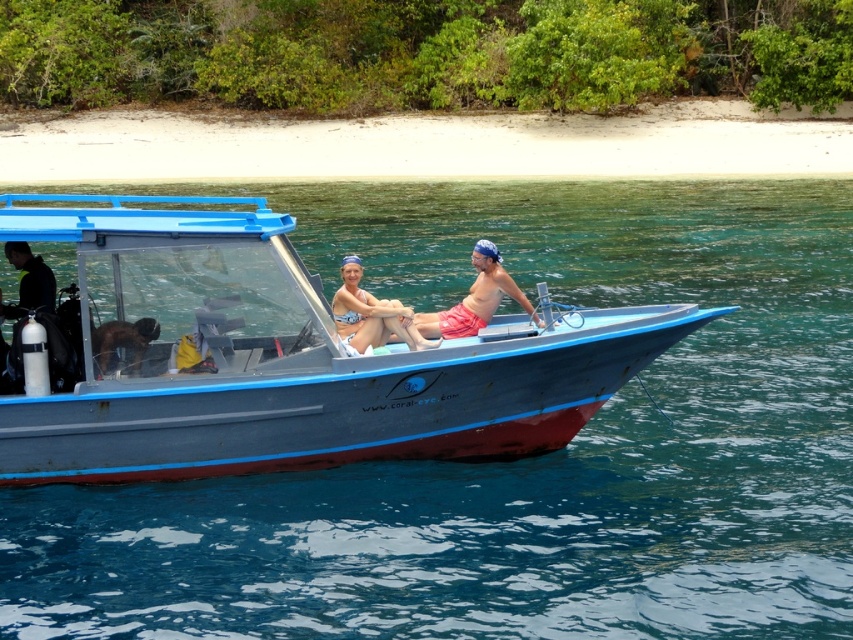
Question: Considering the real-world distances, which object is closest to the matte pink bikini at center?

Choices:
 (A) blue metallic boat at center
 (B) matte orange shorts at center

Answer: (B)

Question: From the image, what is the correct spatial relationship of matte orange shorts at center in relation to matte pink bikini at center?

Choices:
 (A) right
 (B) left

Answer: (A)

Question: Is blue metallic boat at center bigger than matte orange shorts at center?

Choices:
 (A) no
 (B) yes

Answer: (B)

Question: Which point appears closest to the camera in this image?

Choices:
 (A) 491,266
 (B) 302,381

Answer: (B)

Question: Observing the image, what is the correct spatial positioning of matte orange shorts at center in reference to matte pink bikini at center?

Choices:
 (A) below
 (B) above

Answer: (B)

Question: Which is farther from the blue metallic boat at center?

Choices:
 (A) matte orange shorts at center
 (B) matte pink bikini at center

Answer: (B)